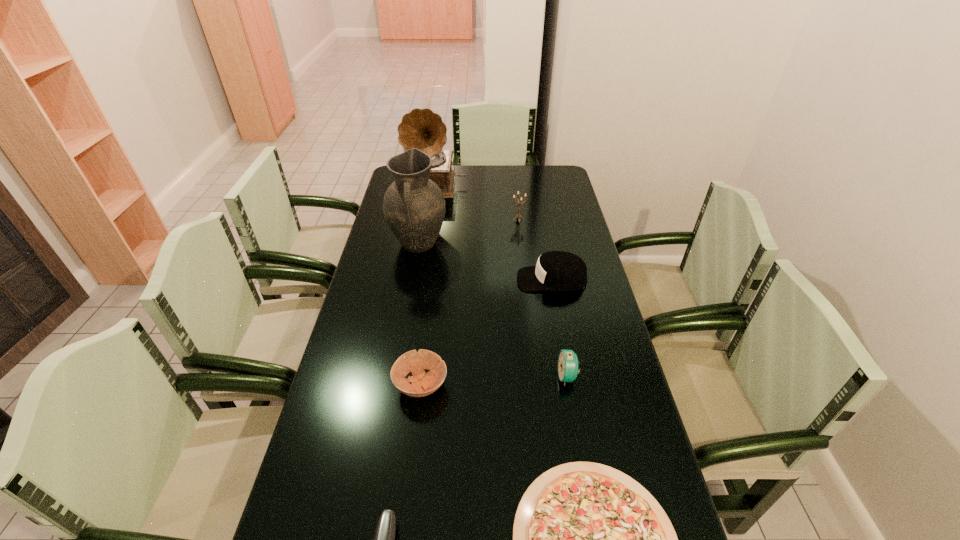
Identify the location of vacant area that lies between the sixth shortest object and the alarm clock. (542, 298).

Image resolution: width=960 pixels, height=540 pixels. I want to click on object that ranks as the seventh closest to the pitcher, so click(x=384, y=539).

The height and width of the screenshot is (540, 960). I want to click on object that stands as the closest to the farthest object, so click(414, 207).

Where is `free space that satisfies the following two spatial constraints: 1. from the horn of the record player; 2. on the right side of the seventh nearest object`? The width and height of the screenshot is (960, 540). free space that satisfies the following two spatial constraints: 1. from the horn of the record player; 2. on the right side of the seventh nearest object is located at coordinates (429, 220).